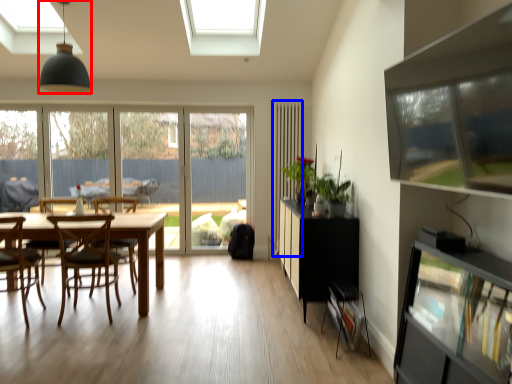
Question: Which object appears farthest to the camera in this image, light fixture (highlighted by a red box) or curtain (highlighted by a blue box)?

Choices:
 (A) light fixture
 (B) curtain

Answer: (B)